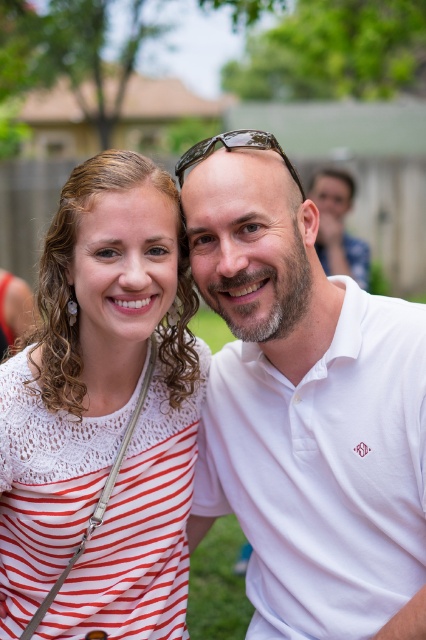
You are a photographer adjusting your camera settings. You notice the white cotton polo shirt at center and the clear plastic sunglasses at center in your frame. Which object should you focus on to ensure the subject in front is sharp?

The white cotton polo shirt at center is closer to the viewer than the clear plastic sunglasses at center, so focusing on the white cotton polo shirt at center will ensure the subject in front is sharp.

Both the man and the woman are wearing white tops in the scene. The man is wearing the white cotton polo shirt at center, and the woman is wearing the white knitted top at center. Which of their tops appears to be wider?

The white cotton polo shirt at center might be wider than the white knitted top at center, so the man is wearing the wider top.

Based on the photo, you are a photographer trying to frame a shot of the white cotton polo shirt at center and the clear plastic sunglasses at center. The minimum distance your camera can focus on two objects is 25 inches. Can you capture both objects clearly in the same frame?

The white cotton polo shirt at center and the clear plastic sunglasses at center are 27.47 inches apart from each other. Since this distance exceeds the camera minimum focus distance of 25 inches, both objects can be captured clearly in the same frame.